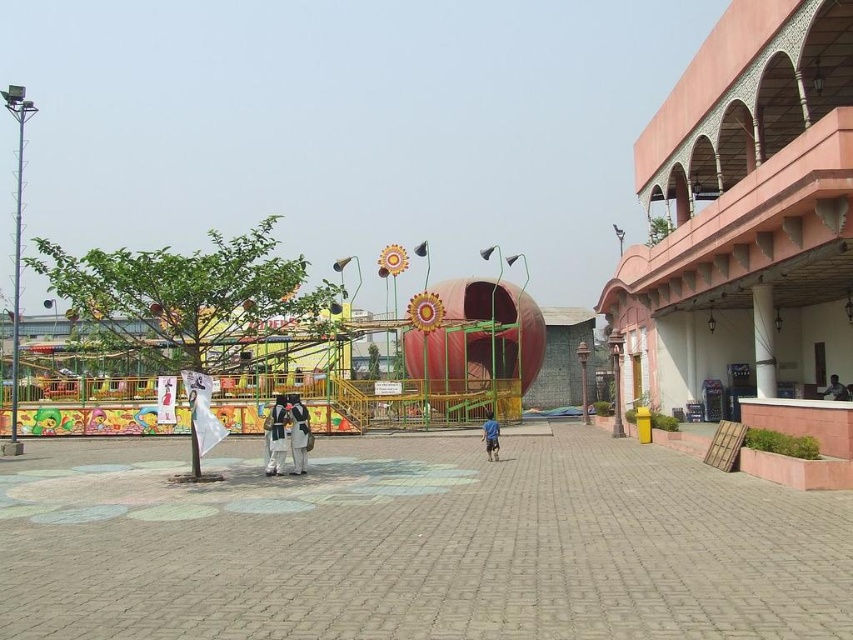
Question: Among these points, which one is farthest from the camera?

Choices:
 (A) (828, 392)
 (B) (496, 428)
 (C) (276, 406)
 (D) (294, 396)

Answer: (A)

Question: Which object is positioned farthest from the dark blue fabric shirt at right?

Choices:
 (A) dark brown leather jacket at center
 (B) metallic amusement park ride at center

Answer: (B)

Question: Which point appears closest to the camera in this image?

Choices:
 (A) (758, 484)
 (B) (302, 461)
 (C) (267, 468)

Answer: (A)

Question: Is dark brown leather jacket at center closer to the viewer compared to dark blue fabric pants at center?

Choices:
 (A) no
 (B) yes

Answer: (B)

Question: Is smooth concrete pavement at center to the right of blue fabric person at center from the viewer's perspective?

Choices:
 (A) no
 (B) yes

Answer: (A)

Question: Can you confirm if dark blue fabric pants at center is positioned above blue fabric person at center?

Choices:
 (A) yes
 (B) no

Answer: (A)